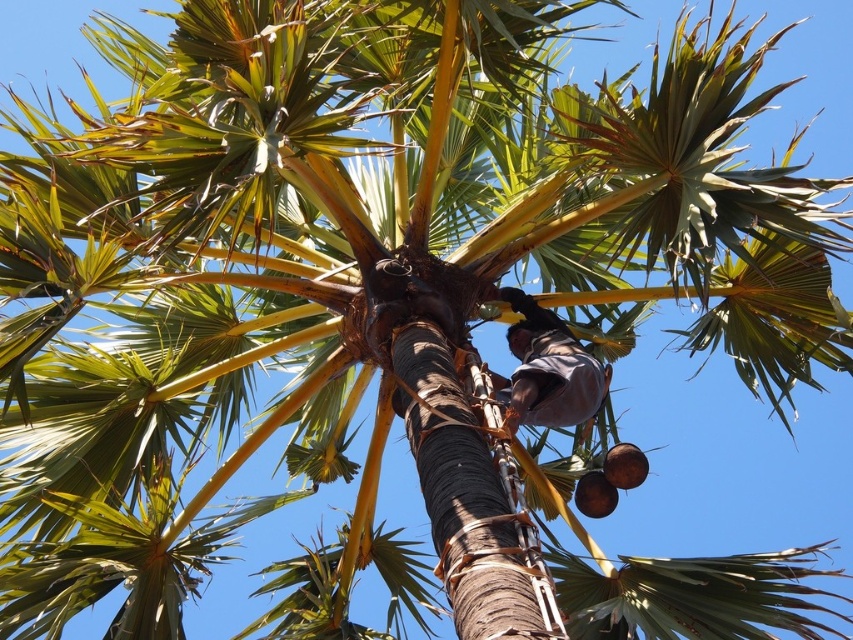
You are standing under the palm tree and see two points marked on the trunk. Which point is closer to you, point (525, 376) or point (592, 492)?

Point (525, 376) is closer to the viewer than point (592, 492).

You are a coconut farmer trying to reach the coconuts on the palm tree. You have a ladder that can only reach up to 2 meters. Which coconut, the brown rough coconut at lower right or the brown matte coconut at lower right, is taller and thus might be within your ladder reach?

The brown rough coconut at lower right is taller than the brown matte coconut at lower right, so it might be within your ladder reach if the height difference is within the 2 meters limit.

You are standing under the palm tree and notice both the brown fabric at center and the brown matte coconut at lower right. Which object is positioned closer to the trunk of the palm tree?

The brown fabric at center is closer to the trunk of the palm tree because it is to the left of the brown matte coconut at lower right, which is further away from the trunk.